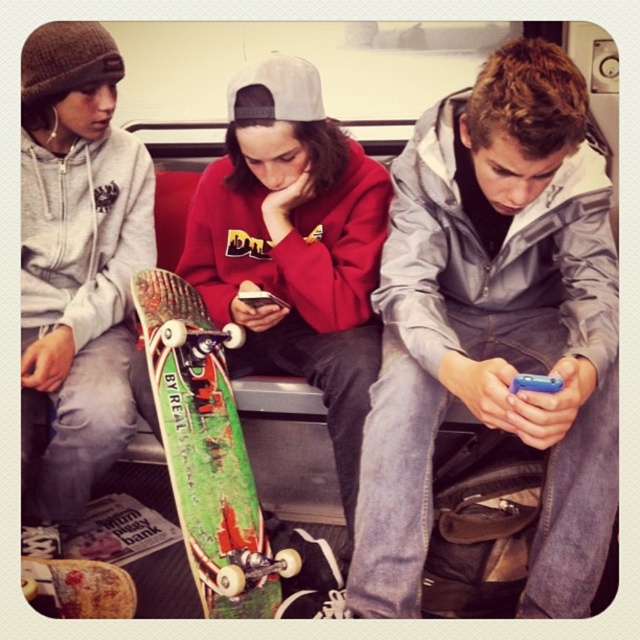
You are a delivery person who needs to place a large package on the floor between the green painted skateboard at center and the green wooden skateboard at lower left. Can you fit it there?

The green painted skateboard at center is larger than the green wooden skateboard at lower left. The space between them may vary depending on their exact positioning, but since the green painted skateboard takes up more space, there might be limited room. However, without knowing the exact dimensions of the package or the distance between the skateboards, it is difficult to determine if it will fit. Please check the available space carefully.

You are a photographer trying to capture a candid shot of the silver metallic jacket at center and the green wooden skateboard at lower left. Since you want to ensure both subjects are in focus, you need to know their relative sizes. Which object is bigger?

The silver metallic jacket at center is larger in size than the green wooden skateboard at lower left, so you should adjust your camera settings to accommodate the size difference for better focus.

You are a photographer standing in the subway car and want to take a photo of both the green painted skateboard at center and the green wooden skateboard at lower left. Which skateboard should you focus on first if you want to capture both in one shot without moving the camera?

The green painted skateboard at center is much taller than the green wooden skateboard at lower left, so you should focus on the green painted skateboard at center first to ensure it fits into the frame properly before adjusting for the smaller one.